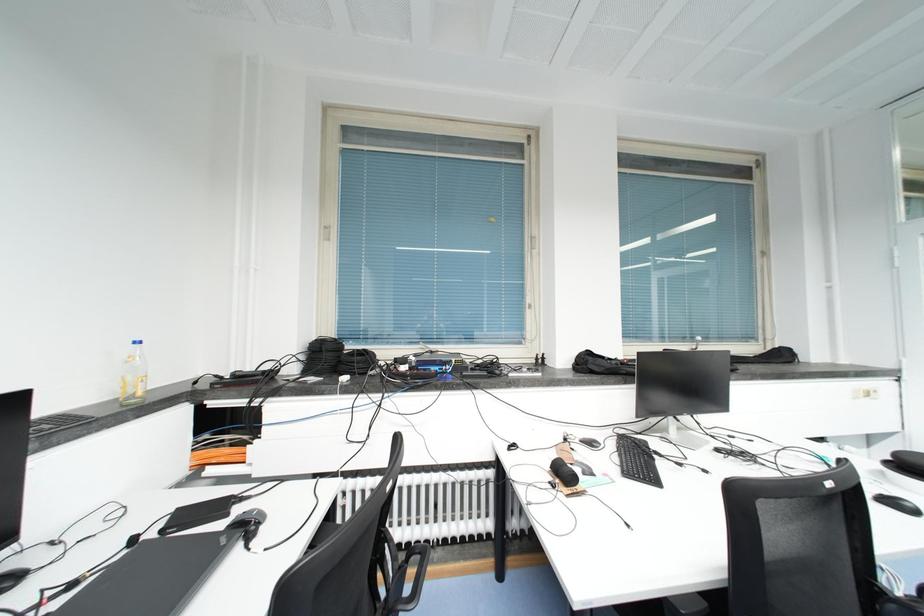
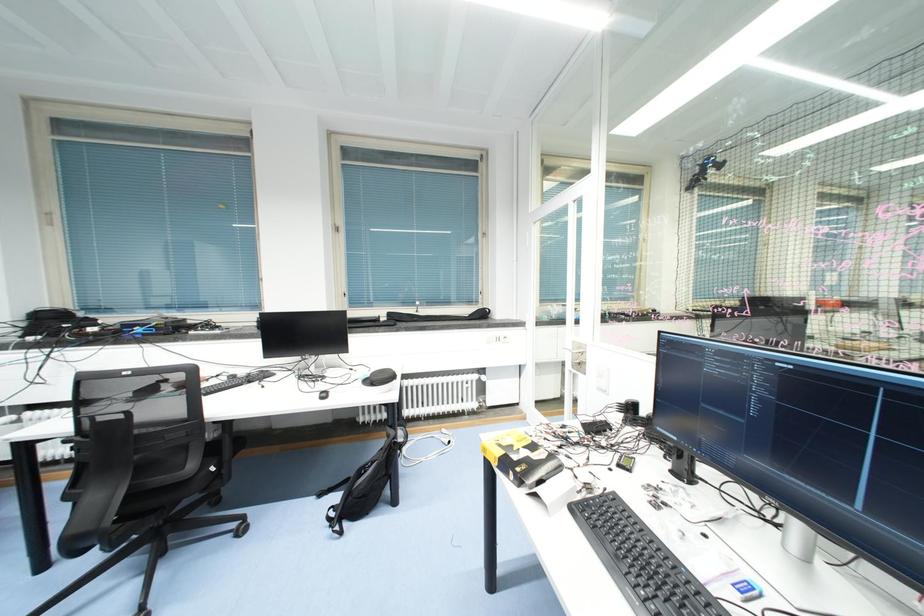
Question: The images are taken continuously from a first-person perspective. In which direction are you moving?

Choices:
 (A) Left
 (B) Right
 (C) Forward
 (D) Backward

Answer: (B)